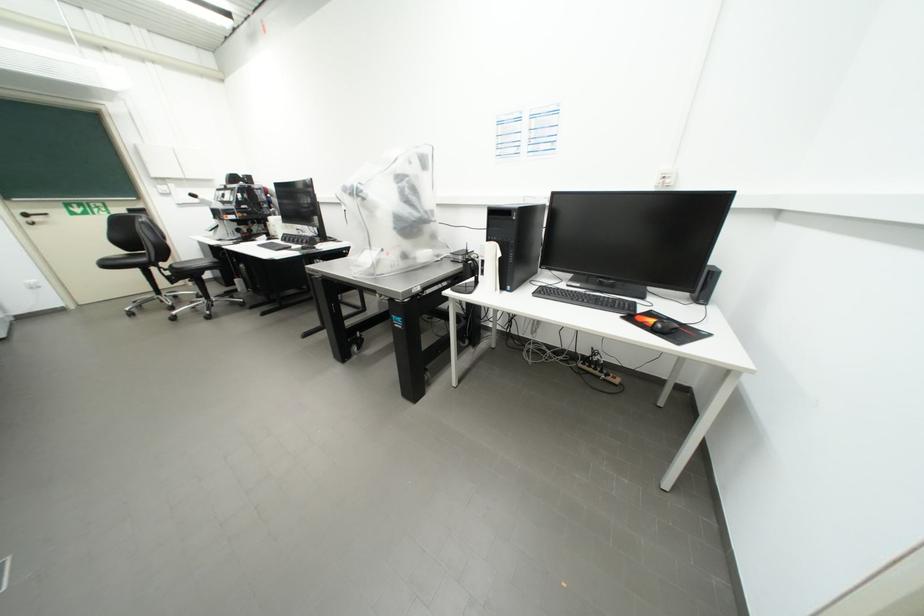
Where would you pull the black door handle? Please return your answer as a coordinate pair (x, y).

(40, 217)